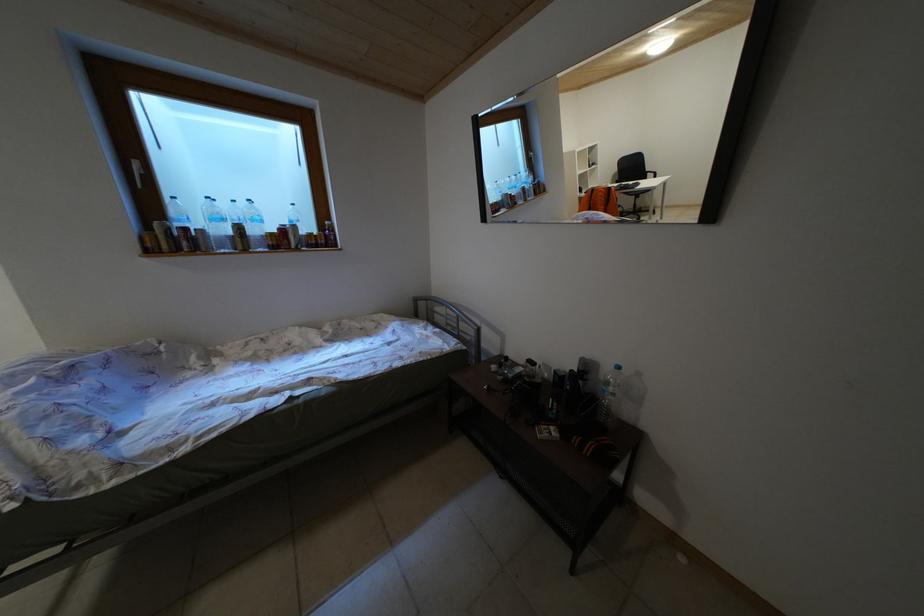
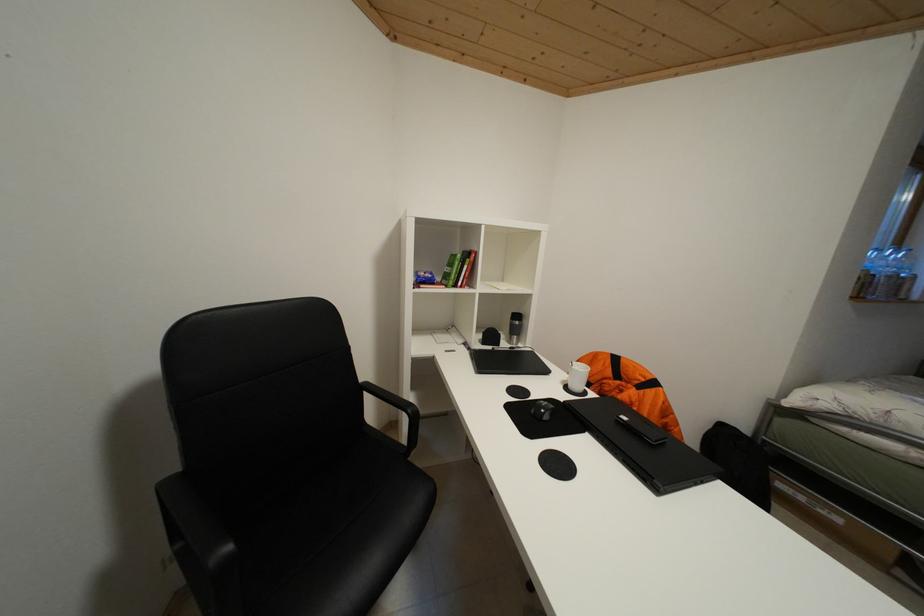
Question: Which direction would the cameraman need to move to produce the second image? Reply with the corresponding letter.

Choices:
 (A) Left
 (B) Right
 (C) Forward
 (D) Backward

Answer: (A)